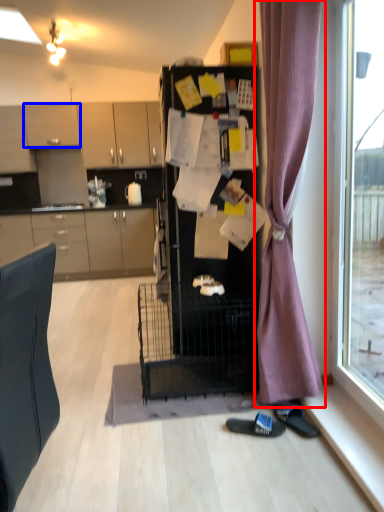
Question: Which point is further to the camera, curtain (highlighted by a red box) or cabinetry (highlighted by a blue box)?

Choices:
 (A) curtain
 (B) cabinetry

Answer: (B)